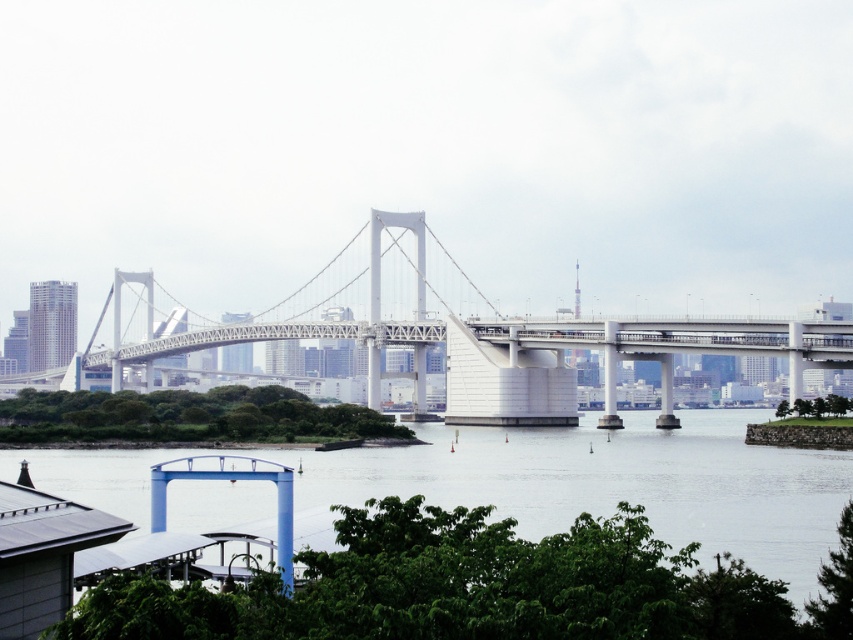
Which is below, transparent water at lower center or white metallic suspension bridge at center?

transparent water at lower center is below.

Is point (521, 486) more distant than point (450, 371)?

No.

What are the coordinates of `transparent water at lower center` in the screenshot? It's located at (610, 483).